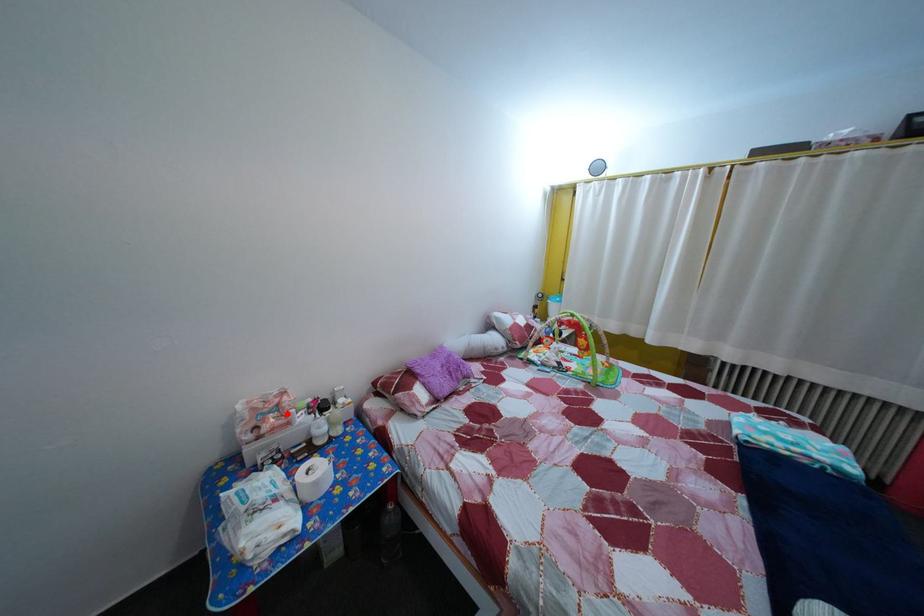
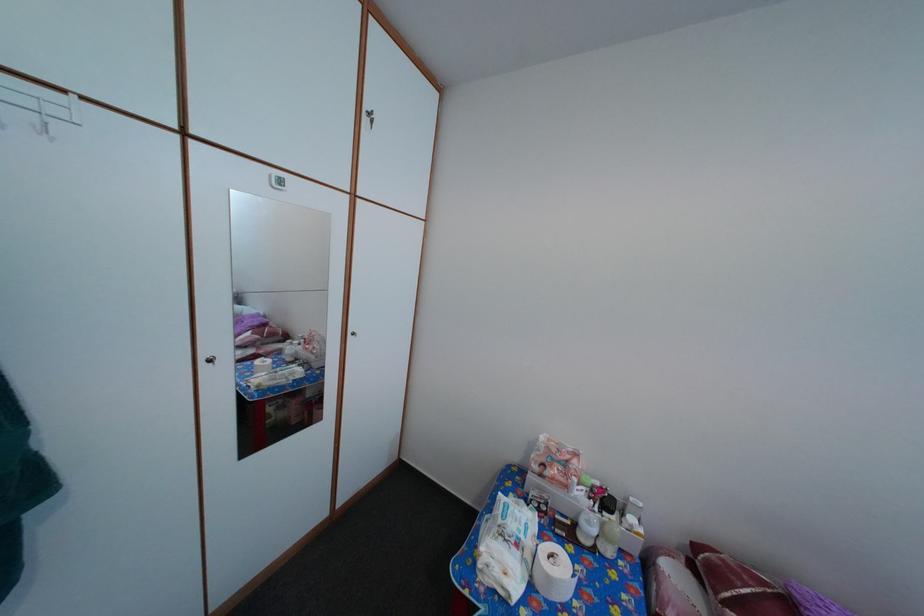
Question: I am providing you with two images of the same scene from different viewpoints. Image1 has a red point marked. In image2, the corresponding 3D location appears at what relative position? Reply with the corresponding letter.

Choices:
 (A) Closer
 (B) Farther

Answer: (B)